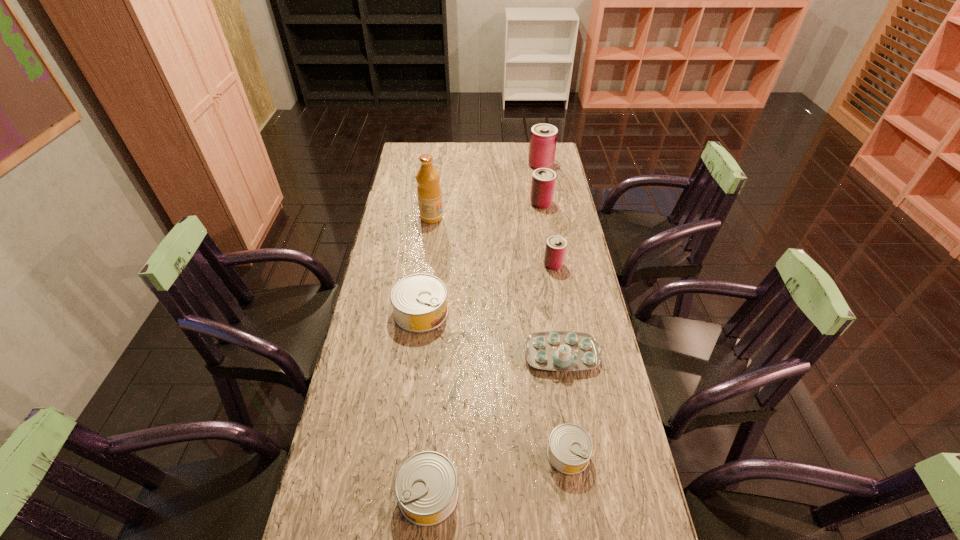
What are the coordinates of `vacant space situated on the left of the biggest silver can` in the screenshot? It's located at (363, 312).

Identify the location of blank space located on the front of the blue chinaware. The width and height of the screenshot is (960, 540). (571, 421).

This screenshot has width=960, height=540. Identify the location of free location located 0.120m on the back of the second shortest can. (435, 418).

In order to click on vacant area located 0.380m on the left of the shortest object in this screenshot , I will do `click(396, 454)`.

Where is `object located in the far edge section of the desktop`? This screenshot has width=960, height=540. object located in the far edge section of the desktop is located at coordinates (543, 138).

Identify the location of fruit juice that is positioned at the left edge. The image size is (960, 540). (428, 190).

This screenshot has width=960, height=540. In order to click on can present at the left edge in this screenshot , I will do `click(419, 301)`.

Locate an element on the screen. chinaware that is at the right edge is located at coordinates coord(551,350).

Locate an element on the screen. This screenshot has height=540, width=960. object present at the far right corner is located at coordinates (543, 138).

In the image, there is a desktop. At what (x,y) coordinates should I click in order to perform the action: click on free space at the far edge. Please return your answer as a coordinate pair (x, y). Image resolution: width=960 pixels, height=540 pixels. Looking at the image, I should click on (515, 155).